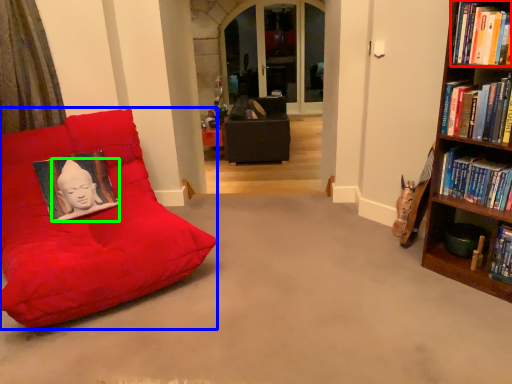
Question: Which is farther away from book (highlighted by a red box)? furniture (highlighted by a blue box) or person (highlighted by a green box)?

Choices:
 (A) furniture
 (B) person

Answer: (B)